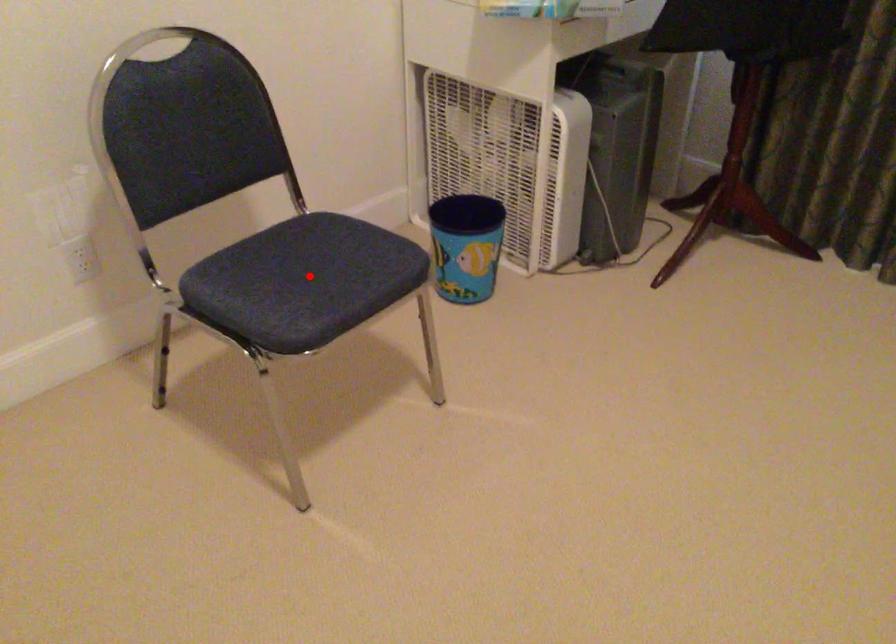
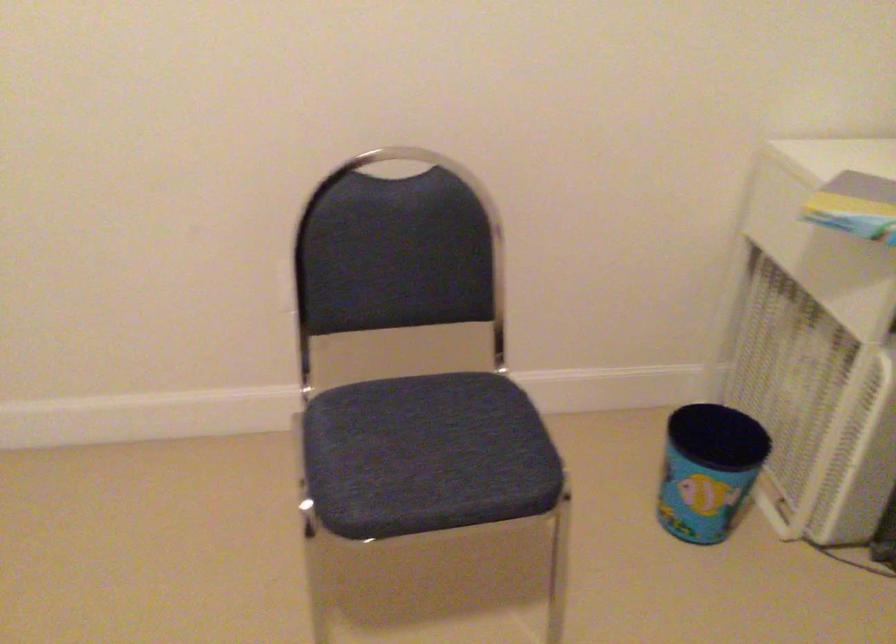
Find the pixel in the second image that matches the highlighted location in the first image.

(426, 455)